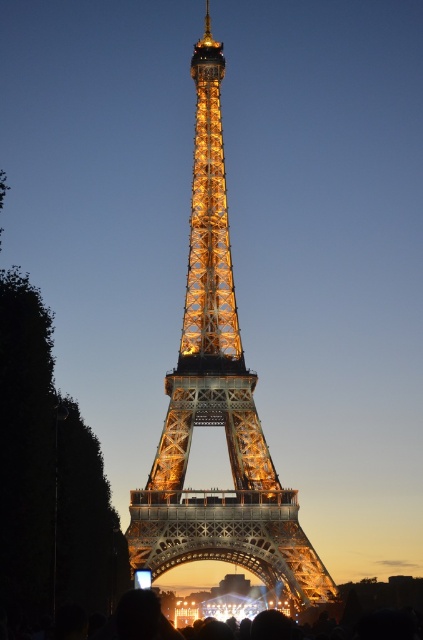
You are standing at the base of the Eiffel Tower and want to take a photo of the point at coordinates (291, 598). If your camera has a maximum zoom range of 100 meters, will you be able to capture that point clearly?

The distance of point (291, 598) from viewer is 121.52 meters. Since the camera can only zoom up to 100 meters, you won

You are standing near the Eiffel Tower and want to take a photo of the illuminated steel eiffel tower at center and the black matte crowd at lower center. Which object should you position to the right side of your camera frame?

You should position the black matte crowd at lower center to the right side of your camera frame because the illuminated steel eiffel tower at center is to the left of it.